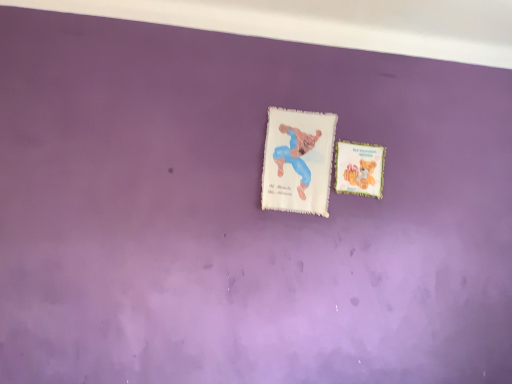
Question: Considering the positions of white fluffy postcard at center, which is the 2th postcard from right to left, and matte paper postcard at upper right, marked as the 1th postcard in a right-to-left arrangement, in the image, is white fluffy postcard at center, which is the 2th postcard from right to left, taller or shorter than matte paper postcard at upper right, marked as the 1th postcard in a right-to-left arrangement,?

Choices:
 (A) short
 (B) tall

Answer: (B)

Question: From a real-world perspective, is white fluffy postcard at center, which appears as the 1th postcard when viewed from the left, physically located above or below matte paper postcard at upper right, which is the 2th postcard from left to right?

Choices:
 (A) below
 (B) above

Answer: (A)

Question: Is point (287, 195) positioned closer to the camera than point (354, 163)?

Choices:
 (A) closer
 (B) farther

Answer: (A)

Question: In terms of height, does matte paper postcard at upper right, which is the 2th postcard from left to right, look taller or shorter compared to white fluffy postcard at center, which appears as the 1th postcard when viewed from the left?

Choices:
 (A) short
 (B) tall

Answer: (A)

Question: Based on their sizes in the image, would you say matte paper postcard at upper right, which is the 2th postcard from left to right, is bigger or smaller than white fluffy postcard at center, which is the 2th postcard from right to left?

Choices:
 (A) big
 (B) small

Answer: (B)

Question: Is point (367, 183) positioned closer to the camera than point (276, 127)?

Choices:
 (A) farther
 (B) closer

Answer: (B)

Question: From a real-world perspective, is matte paper postcard at upper right, which is the 2th postcard from left to right, physically located above or below white fluffy postcard at center, which appears as the 1th postcard when viewed from the left?

Choices:
 (A) above
 (B) below

Answer: (A)